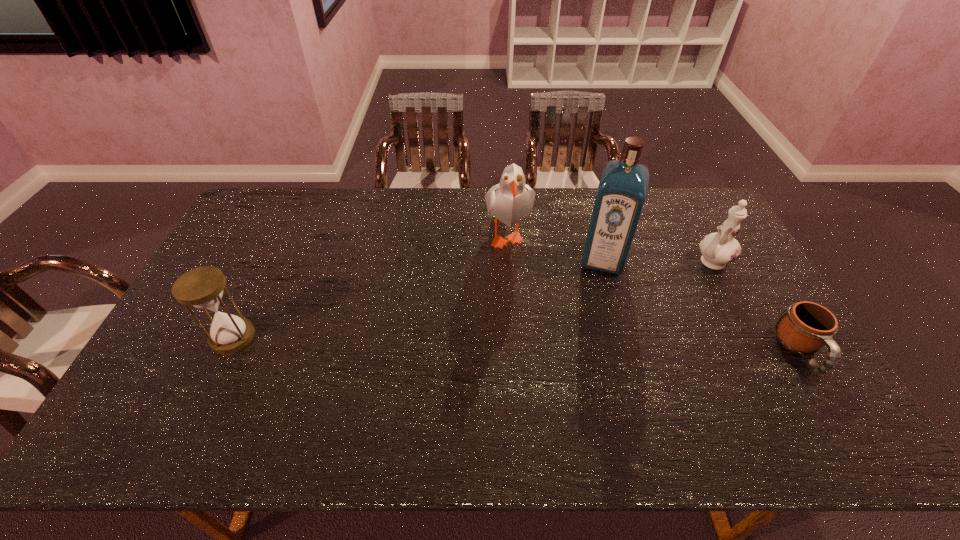
The width and height of the screenshot is (960, 540). Find the location of `object present at the left edge`. object present at the left edge is located at coordinates (202, 287).

Find the location of a particular element. This screenshot has width=960, height=540. mug that is at the right edge is located at coordinates (804, 327).

The image size is (960, 540). I want to click on chinaware that is positioned at the right edge, so click(718, 249).

You are a GUI agent. You are given a task and a screenshot of the screen. Output one action in this format:
    pyautogui.click(x=<x>, y=<y>)
    Task: Click on the object positioned at the near right corner
    The height and width of the screenshot is (540, 960).
    Given the screenshot: What is the action you would take?
    pyautogui.click(x=804, y=327)

Find the location of a particular element. vacant space at the far edge is located at coordinates (438, 197).

The image size is (960, 540). I want to click on vacant space at the near edge of the desktop, so click(672, 394).

Find the location of `vacant space at the left edge of the desktop`. vacant space at the left edge of the desktop is located at coordinates pyautogui.click(x=200, y=344).

Identify the location of vacant space at the right edge of the desktop. This screenshot has height=540, width=960. (730, 266).

Where is `vacant position at the near left corner of the desktop`? This screenshot has height=540, width=960. vacant position at the near left corner of the desktop is located at coordinates (149, 385).

You are a GUI agent. You are given a task and a screenshot of the screen. Output one action in this format:
    pyautogui.click(x=<x>, y=<y>)
    Task: Click on the vacant space at the near right corner of the desktop
    The width and height of the screenshot is (960, 540).
    Given the screenshot: What is the action you would take?
    pyautogui.click(x=762, y=390)